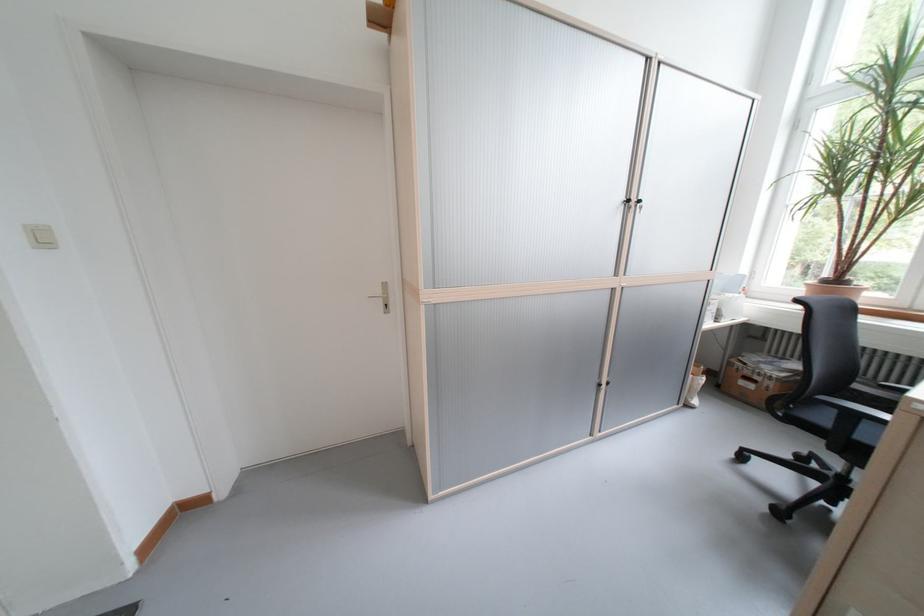
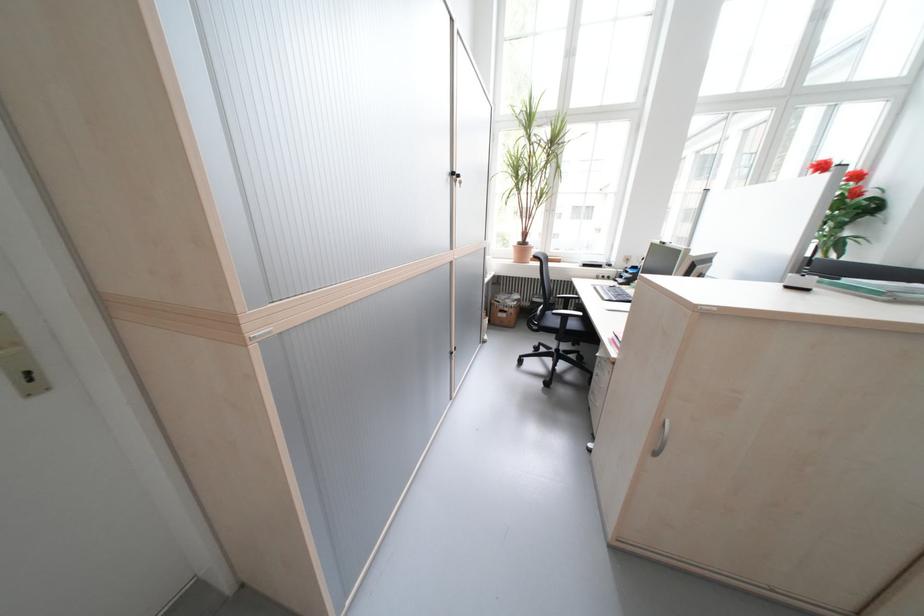
Question: Based on the continuous images, in which direction is the camera rotating? Reply with the corresponding letter.

Choices:
 (A) Left
 (B) Right
 (C) Up
 (D) Down

Answer: (B)